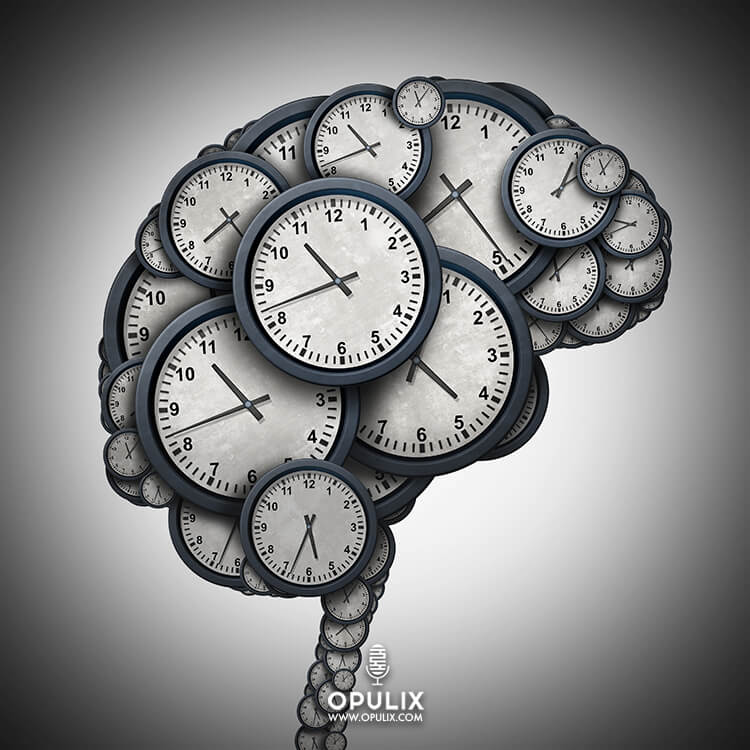
Where is `largest clocks`? The image size is (750, 750). largest clocks is located at coordinates (474, 166), (457, 351), (274, 421).